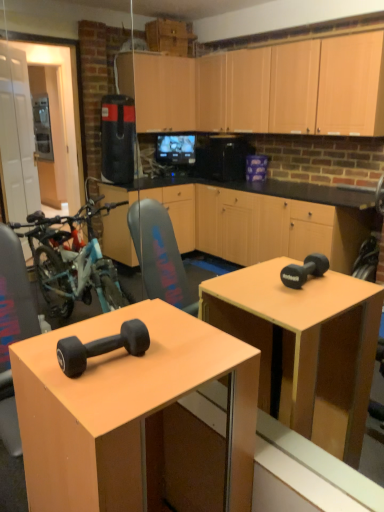
Locate an element on the screen. free spot in front of black rubber dumbbell at lower left is located at coordinates (103, 397).